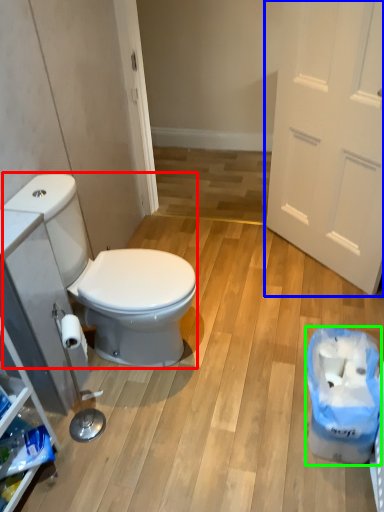
Question: Which object is the closest to the sit (highlighted by a red box)? Choose among these: door (highlighted by a blue box) or recycling bin (highlighted by a green box).

Choices:
 (A) door
 (B) recycling bin

Answer: (B)